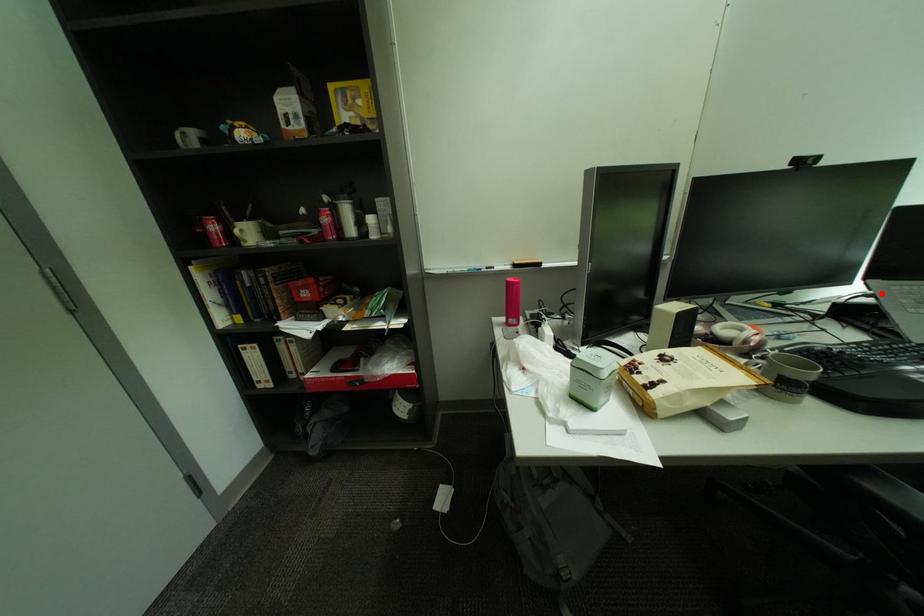
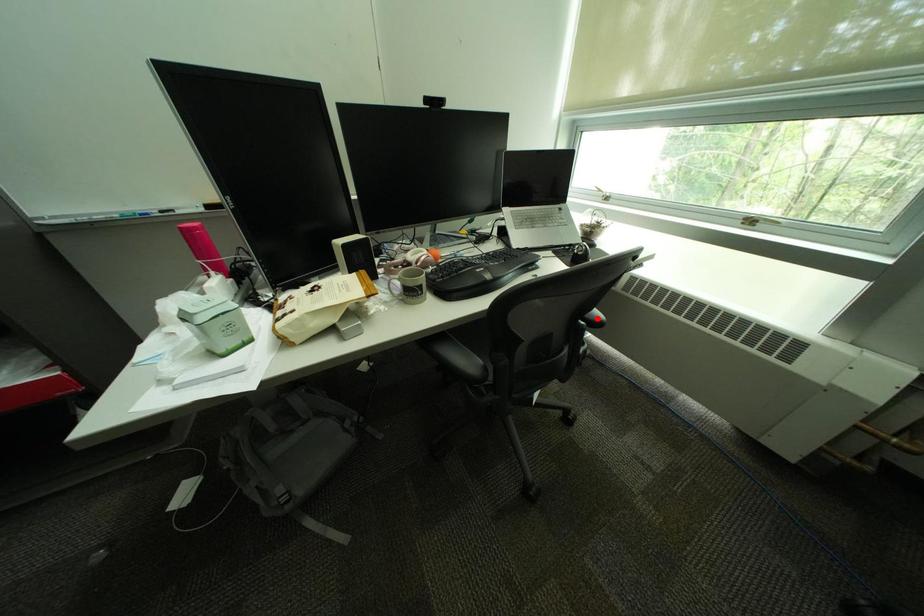
I am providing you with two images of the same scene from different viewpoints. A red point is marked on the first image and another point is marked on the second image. Do the highlighted points in image1 and image2 indicate the same real-world spot?

No